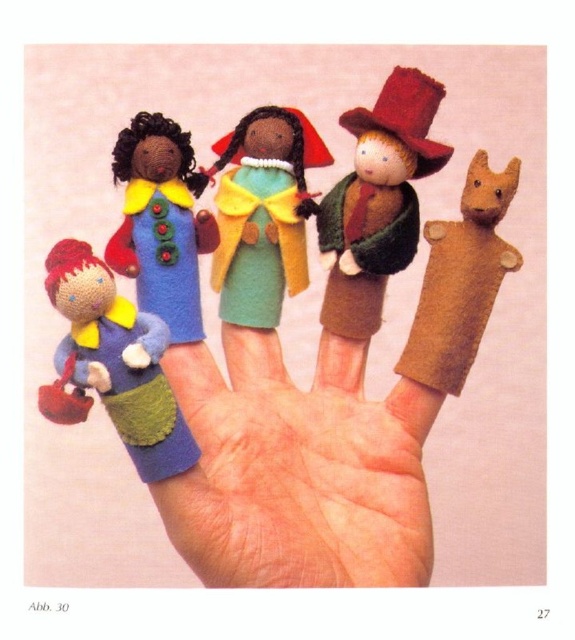
Looking at the finger puppets on the hand, which one is wider between the matte blue felt doll at left and the brown felt dog at right?

The matte blue felt doll at left is wider than the brown felt dog at right.

You are a toy organizer who needs to place the blue felt doll at center and the brown felt dog at right into a storage box. The box has a maximum length of 12 inches. Can both items fit side by side in the box without overlapping?

The blue felt doll at center is 11.51 inches away from the brown felt dog at right, so they can fit side by side in the 12 inch box since the distance between them is less than the box length.